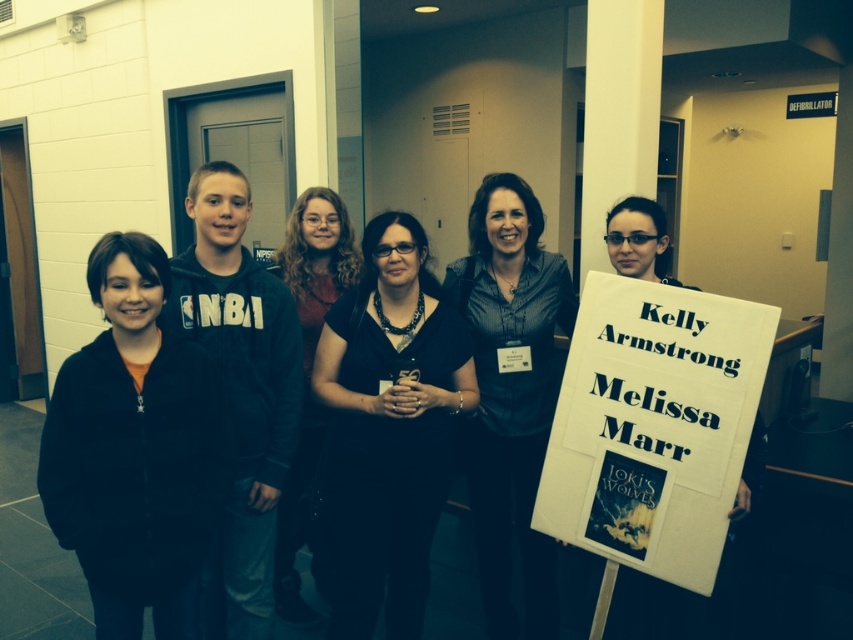
You are attending an event and see the white paper sign at center and the dark blue shirt at center. Which object is closer to you?

The white paper sign at center is closer to you because it is in front of the dark blue shirt at center.

You are a photographer trying to capture a clear photo of the white paper sign at center and the matte black jacket at center. Which object is closer to the camera, making it appear in front?

The white paper sign at center is in front of the matte black jacket at center, so the white paper sign at center is closer to the camera.